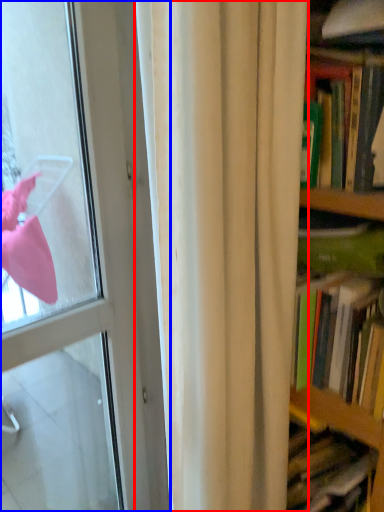
Question: Which object is further to the camera taking this photo, curtain (highlighted by a red box) or door (highlighted by a blue box)?

Choices:
 (A) curtain
 (B) door

Answer: (B)